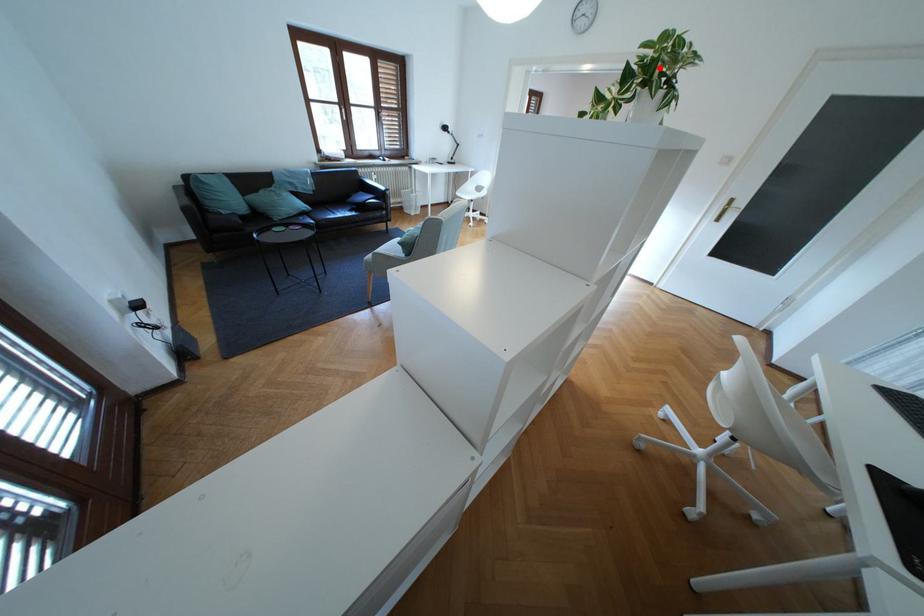
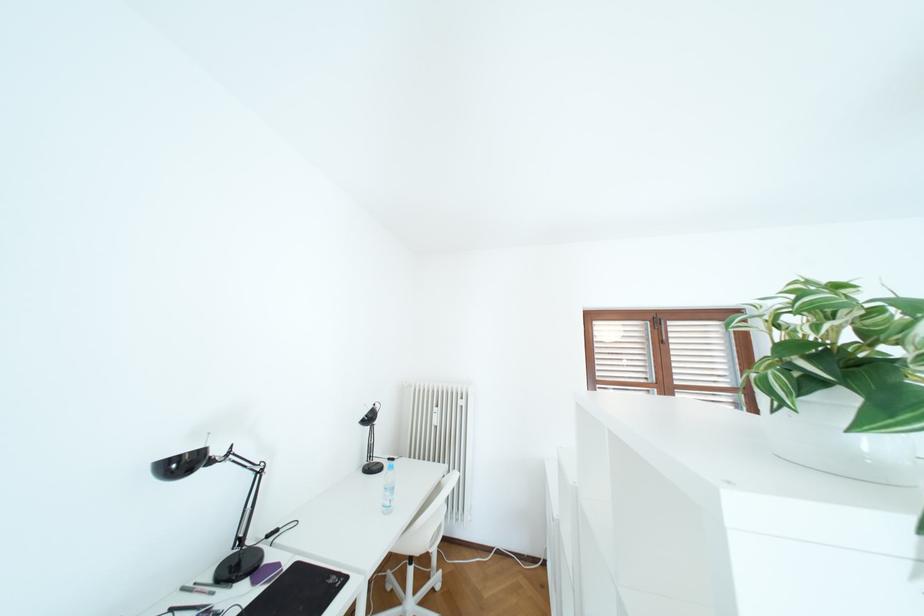
Find the pixel in the second image that matches the highlighted location in the first image.

(811, 339)